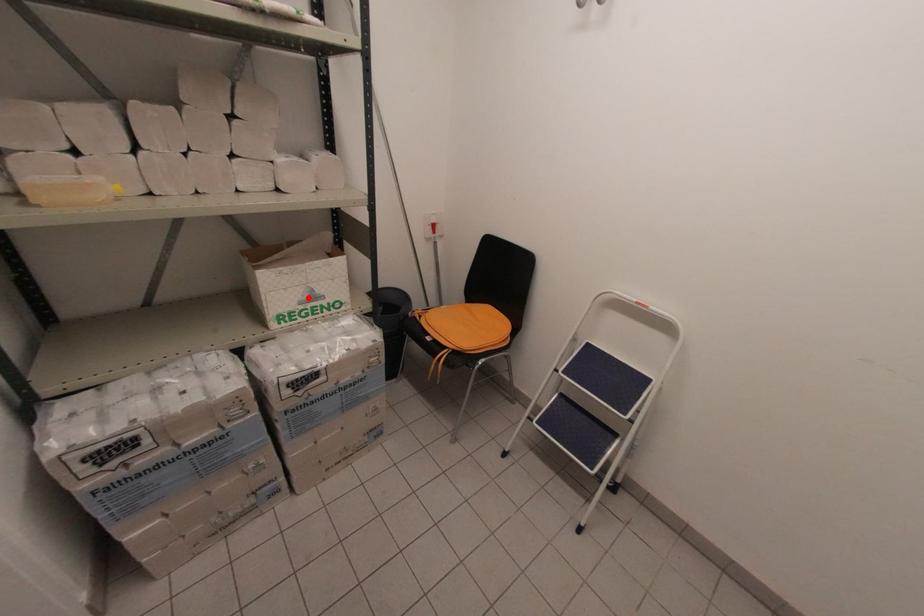
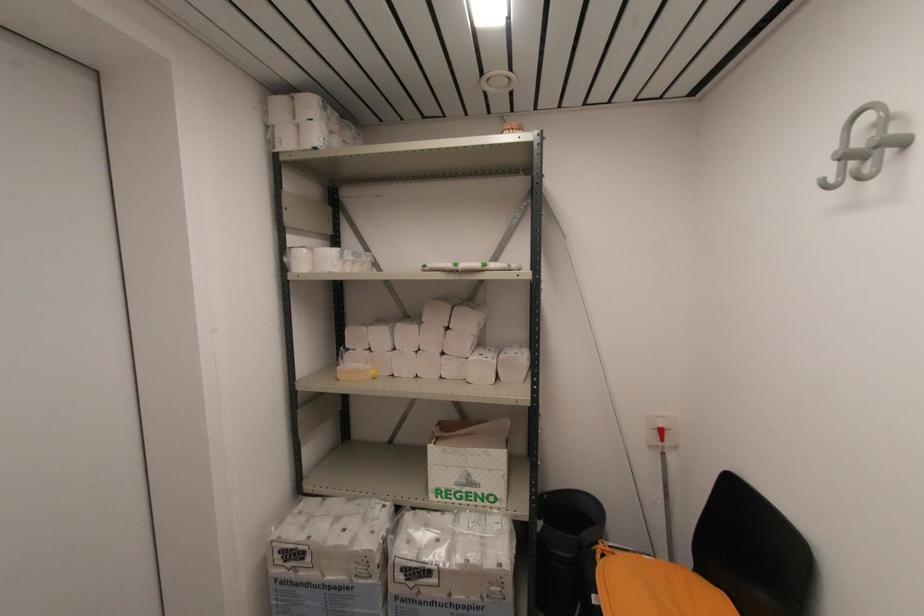
Where in the second image is the point corresponding to the highlighted location from the first image?

(465, 480)